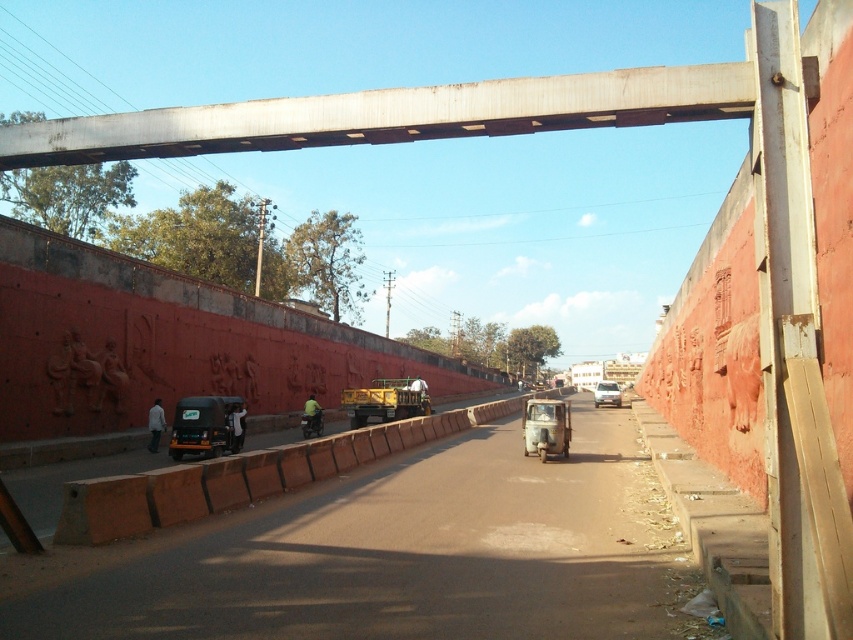
Question: Can you confirm if brown concrete barrier at center is positioned to the right of matte black auto-rickshaw at left?

Choices:
 (A) no
 (B) yes

Answer: (B)

Question: Is brown concrete highway at center below brown concrete barrier at center?

Choices:
 (A) no
 (B) yes

Answer: (A)

Question: Can you confirm if matte black auto-rickshaw at left is bigger than green matte motorcycle at center?

Choices:
 (A) no
 (B) yes

Answer: (B)

Question: Which point appears farthest from the camera in this image?

Choices:
 (A) pyautogui.click(x=555, y=513)
 (B) pyautogui.click(x=315, y=429)
 (C) pyautogui.click(x=216, y=428)
 (D) pyautogui.click(x=541, y=412)

Answer: (B)

Question: Which of the following is the farthest from the observer?

Choices:
 (A) (306, 428)
 (B) (140, 589)

Answer: (A)

Question: Which point is farther to the camera?

Choices:
 (A) (215, 545)
 (B) (305, 426)
 (C) (177, 440)

Answer: (B)